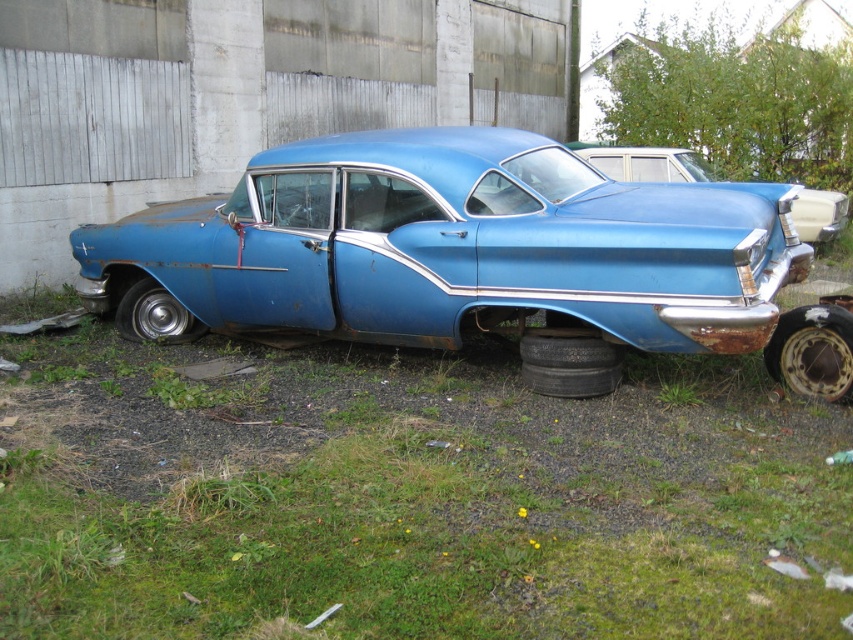
This screenshot has width=853, height=640. What do you see at coordinates (813, 352) in the screenshot? I see `rusty metal tire at lower right` at bounding box center [813, 352].

Does rusty metal tire at lower right appear under rusty metal tire at lower left?

Yes, rusty metal tire at lower right is below rusty metal tire at lower left.

The height and width of the screenshot is (640, 853). What are the coordinates of `rusty metal tire at lower right` in the screenshot? It's located at (813, 352).

Where is `rusty metal tire at lower right`? rusty metal tire at lower right is located at coordinates (813, 352).

Can you confirm if rusty metallic car at right is positioned below rusty metal tire at lower left?

No, rusty metallic car at right is not below rusty metal tire at lower left.

Is rusty metallic car at right thinner than rusty metal tire at lower left?

Incorrect, rusty metallic car at right's width is not less than rusty metal tire at lower left's.

Describe the element at coordinates (645, 163) in the screenshot. The height and width of the screenshot is (640, 853). I see `rusty metallic car at right` at that location.

Find the location of a particular element. The image size is (853, 640). rusty metallic car at right is located at coordinates (645, 163).

Who is more forward, (x=606, y=387) or (x=123, y=305)?

Point (x=606, y=387)

Who is positioned more to the right, black rubber tire at lower right or rusty metal tire at lower left?

From the viewer's perspective, black rubber tire at lower right appears more on the right side.

Between point (554, 390) and point (134, 324), which one is positioned in front?

Point (554, 390) is more forward.

What are the coordinates of `black rubber tire at lower right` in the screenshot? It's located at (569, 365).